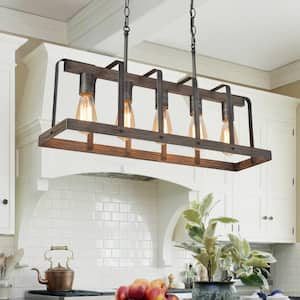
Find the location of `light bulb`. light bulb is located at coordinates (87, 114).